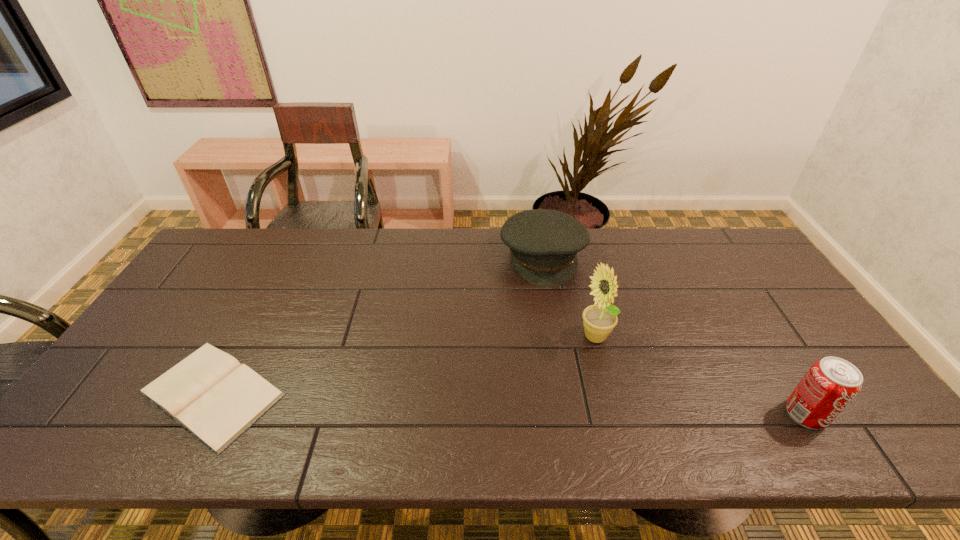
This screenshot has width=960, height=540. Find the location of `vacant space located on the face of the sunflower`. vacant space located on the face of the sunflower is located at coordinates (580, 363).

The height and width of the screenshot is (540, 960). I want to click on free location located 0.110m on the face of the sunflower, so click(568, 378).

Find the location of a particular element. The height and width of the screenshot is (540, 960). free space located 0.360m on the front-facing side of the farthest object is located at coordinates (574, 384).

This screenshot has width=960, height=540. Find the location of `free location located 0.080m on the front-facing side of the farthest object`. free location located 0.080m on the front-facing side of the farthest object is located at coordinates (554, 305).

The image size is (960, 540). Identify the location of vacant space located 0.280m on the front-facing side of the farthest object. (567, 359).

Where is `object located in the far edge section of the desktop`? The height and width of the screenshot is (540, 960). object located in the far edge section of the desktop is located at coordinates (543, 243).

This screenshot has height=540, width=960. Identify the location of Bible that is at the near edge. (213, 396).

Identify the location of soda can that is at the near edge. (831, 383).

The width and height of the screenshot is (960, 540). In order to click on object located at the left edge in this screenshot , I will do `click(213, 396)`.

The image size is (960, 540). In order to click on object present at the right edge in this screenshot , I will do `click(831, 383)`.